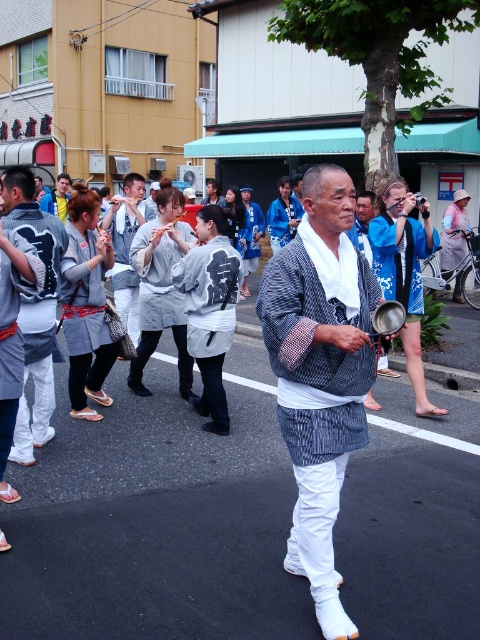
Between gray fabric kimono at center and white cotton kimono at center, which one has more height?

With more height is gray fabric kimono at center.

You are a GUI agent. You are given a task and a screenshot of the screen. Output one action in this format:
    pyautogui.click(x=<x>, y=<y>)
    Task: Click on the gray fabric kimono at center
    
    Given the screenshot: What is the action you would take?
    pyautogui.click(x=35, y=310)

Where is `gray fabric kimono at center`? The image size is (480, 640). gray fabric kimono at center is located at coordinates (35, 310).

From the picture: Does white striped kimono at center have a lesser width compared to gray fabric kimono at center?

Incorrect, white striped kimono at center's width is not less than gray fabric kimono at center's.

Between white striped kimono at center and gray fabric kimono at center, which one is positioned lower?

Positioned lower is gray fabric kimono at center.

Is point (323, 369) positioned after point (3, 221)?

No, (323, 369) is closer to viewer.

Identify the location of white striped kimono at center. (320, 372).

Who is more distant from viewer, [326,221] or [131,218]?

Point [131,218]

Consider the image. Is white striped kimono at center smaller than white cotton kimono at center?

No.

Identify the location of white striped kimono at center. (320, 372).

Find the location of a particular element. This screenshot has height=640, width=480. white striped kimono at center is located at coordinates (320, 372).